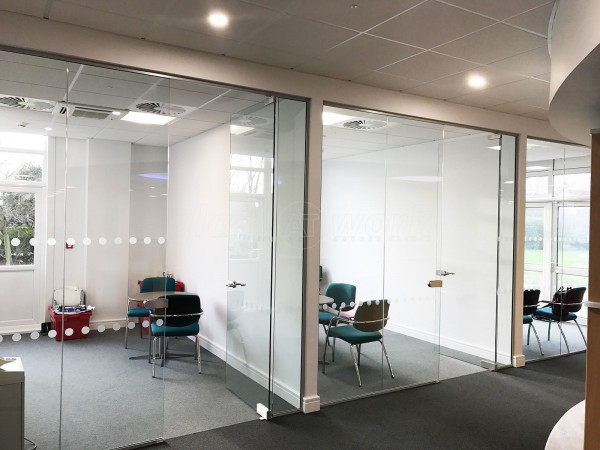
Where is `floor`? Image resolution: width=600 pixels, height=450 pixels. floor is located at coordinates (175, 415), (416, 360), (461, 435), (550, 341).